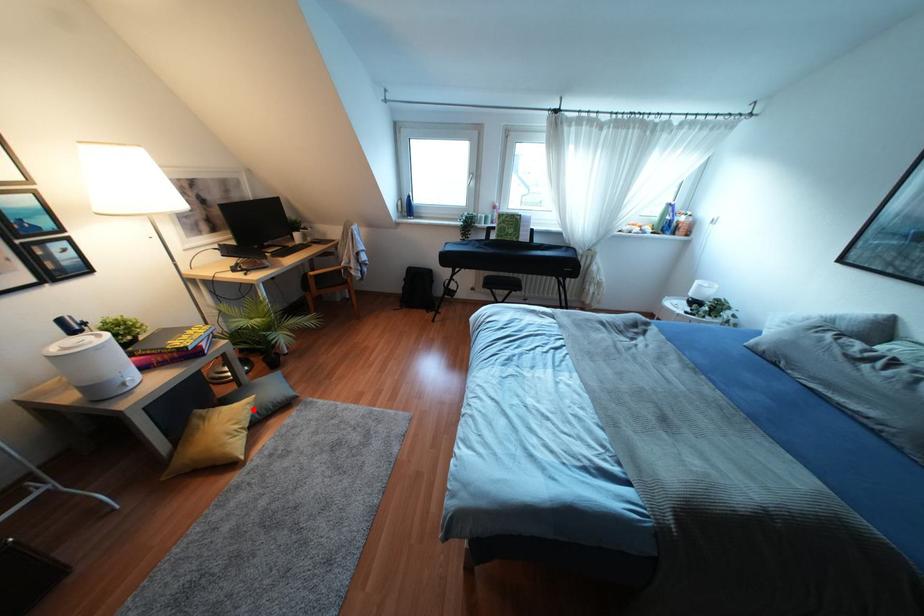
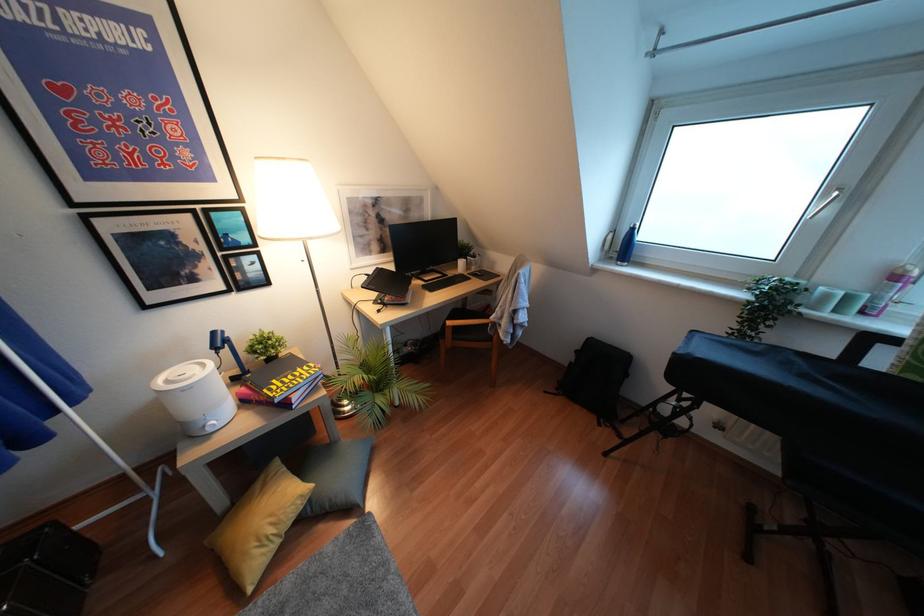
In the second image, find the point that corresponds to the highlighted location in the first image.

(310, 500)